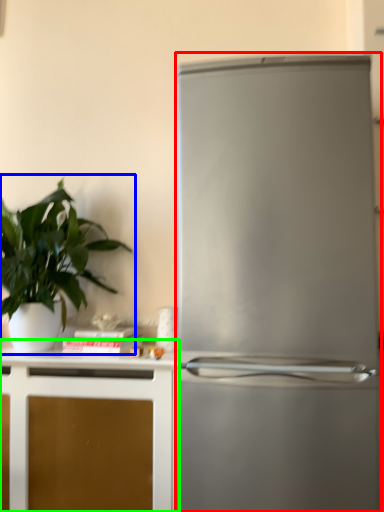
Question: Based on their relative distances, which object is farther from refrigerator (highlighted by a red box)? Choose from houseplant (highlighted by a blue box) and cabinetry (highlighted by a green box).

Choices:
 (A) houseplant
 (B) cabinetry

Answer: (A)